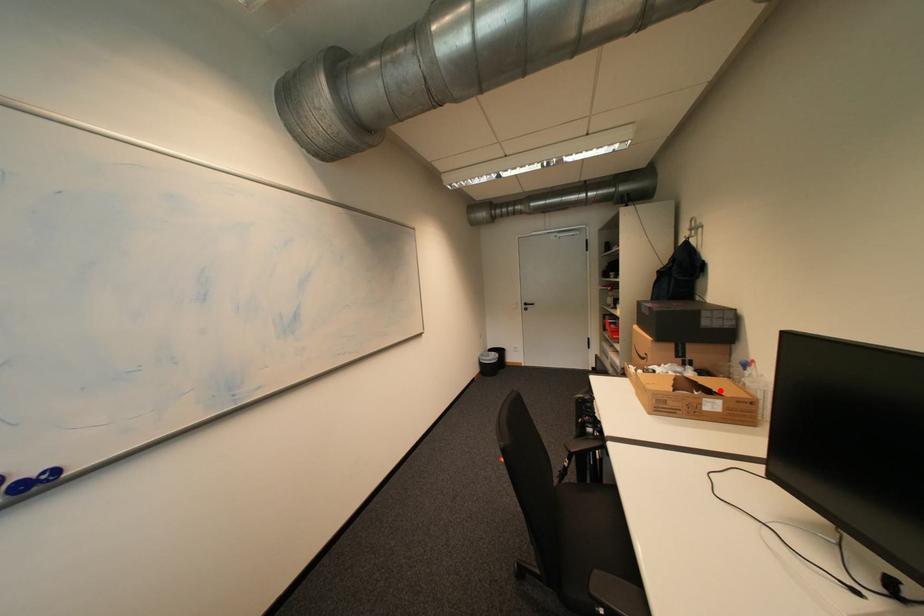
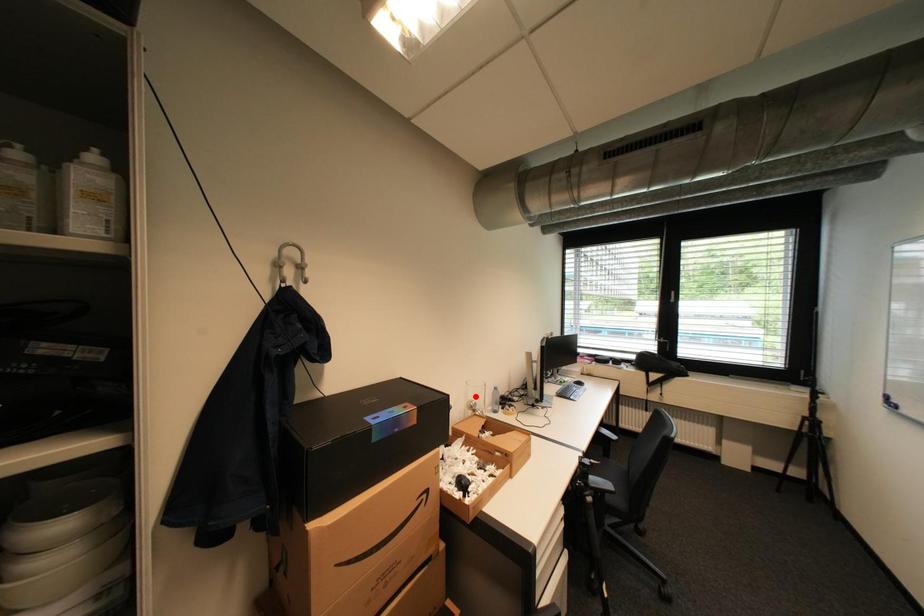
I am providing you with two images of the same scene from different viewpoints. A red point is marked on the first image and another point is marked on the second image. Are the points marked in image1 and image2 representing the same 3D position?

No